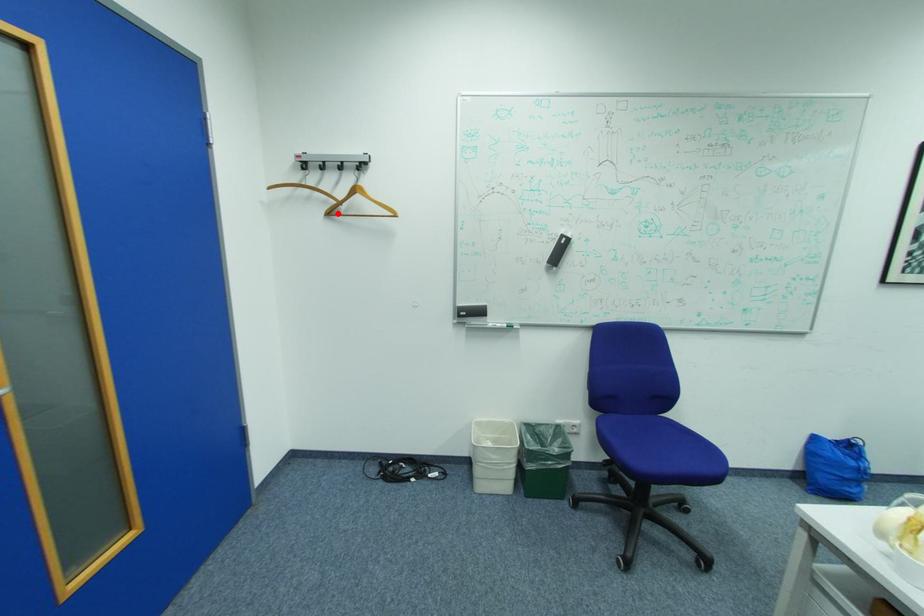
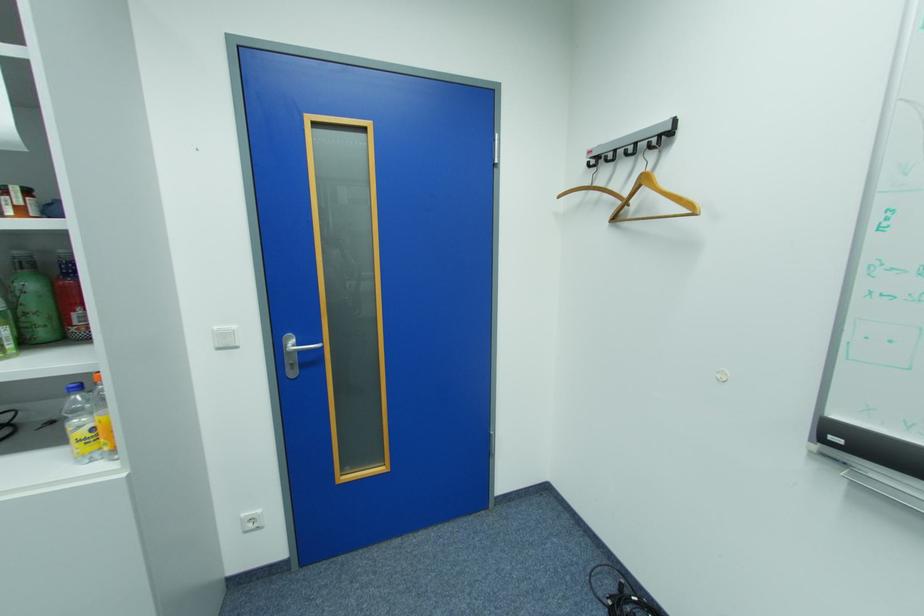
Find the pixel in the second image that matches the highlighted location in the first image.

(624, 220)